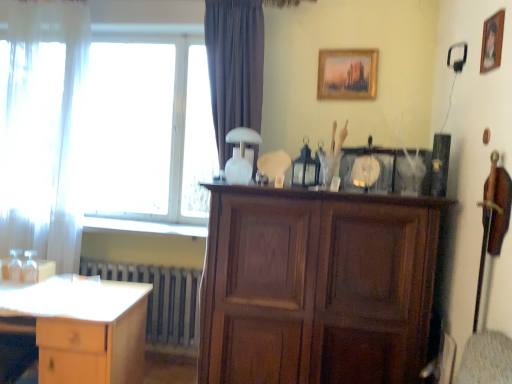
Where is `wooden cabinet at center`? wooden cabinet at center is located at coordinates (316, 287).

Locate an element on the screen. The image size is (512, 384). transparent glass window at upper left is located at coordinates (128, 128).

At what (x,y) coordinates should I click in order to perform the action: click on wooden picture frame at upper right, the first picture frame from the right. Please return your answer as a coordinate pair (x, y). Image resolution: width=512 pixels, height=384 pixels. Looking at the image, I should click on (492, 42).

Considering the relative sizes of light wood desk at lower left and transparent glass window at upper left in the image provided, is light wood desk at lower left smaller than transparent glass window at upper left?

Incorrect, light wood desk at lower left is not smaller in size than transparent glass window at upper left.

Are light wood desk at lower left and transparent glass window at upper left making contact?

light wood desk at lower left and transparent glass window at upper left are not in contact.

Considering the positions of objects light wood desk at lower left and transparent glass window at upper left in the image provided, who is behind, light wood desk at lower left or transparent glass window at upper left?

transparent glass window at upper left.

Considering the relative sizes of light wood desk at lower left and transparent glass window at upper left in the image provided, is light wood desk at lower left thinner than transparent glass window at upper left?

In fact, light wood desk at lower left might be wider than transparent glass window at upper left.

Considering the relative positions of wooden cabinet at center and light wood desk at lower left in the image provided, is wooden cabinet at center in front of light wood desk at lower left?

Yes, wooden cabinet at center is in front of light wood desk at lower left.

Would you say wooden cabinet at center is to the left or to the right of light wood desk at lower left in the picture?

wooden cabinet at center is positioned on light wood desk at lower left's right side.

This screenshot has width=512, height=384. Find the location of `cabinetry that appears above the light wood desk at lower left (from a real-world perspective)`. cabinetry that appears above the light wood desk at lower left (from a real-world perspective) is located at coordinates (316, 287).

Can you confirm if wooden cabinet at center is shorter than light wood desk at lower left?

No.

Would you consider gold-framed painting at upper center, the 1th picture frame from the back, to be distant from transparent glass window at upper left?

gold-framed painting at upper center, the 1th picture frame from the back, is far away from transparent glass window at upper left.

Is point (352, 99) closer or farther from the camera than point (126, 55)?

Point (352, 99) appears to be closer to the viewer than point (126, 55).

From a real-world perspective, does gold-framed painting at upper center, which ranks as the 1th picture frame in left-to-right order, stand above transparent glass window at upper left?

Yes, from a real-world perspective, gold-framed painting at upper center, which ranks as the 1th picture frame in left-to-right order, is over transparent glass window at upper left

Is gold-framed painting at upper center, the 1th picture frame from the back, smaller than transparent glass window at upper left?

Yes.

Is transparent glass window at upper left positioned far away from wooden picture frame at upper right, the first picture frame from the right?

Absolutely, transparent glass window at upper left is distant from wooden picture frame at upper right, the first picture frame from the right.

How distant is transparent glass window at upper left from wooden picture frame at upper right, placed as the 2th picture frame when sorted from back to front?

A distance of 7.48 feet exists between transparent glass window at upper left and wooden picture frame at upper right, placed as the 2th picture frame when sorted from back to front.

From their relative heights in the image, would you say transparent glass window at upper left is taller or shorter than wooden picture frame at upper right, the second picture frame viewed from the left?

Considering their sizes, transparent glass window at upper left has more height than wooden picture frame at upper right, the second picture frame viewed from the left.

Considering the points (92, 171) and (487, 59), which point is behind, point (92, 171) or point (487, 59)?

The point (92, 171) is farther.

Is wooden cabinet at center next to wooden picture frame at upper right, placed as the 1th picture frame when sorted from front to back, and touching it?

No.

Which object is closer to the camera taking this photo, wooden cabinet at center or wooden picture frame at upper right, the first picture frame from the right?

wooden picture frame at upper right, the first picture frame from the right.

Looking at this image, in terms of width, does wooden cabinet at center look wider or thinner when compared to wooden picture frame at upper right, placed as the 1th picture frame when sorted from front to back?

Considering their sizes, wooden cabinet at center looks broader than wooden picture frame at upper right, placed as the 1th picture frame when sorted from front to back.

Consider the image. Does white sheer curtain at left appear on the left side of transparent glass window at upper left?

Yes, white sheer curtain at left is to the left of transparent glass window at upper left.

From the image's perspective, is white sheer curtain at left above transparent glass window at upper left?

Incorrect, from the image's perspective, white sheer curtain at left is lower than transparent glass window at upper left.

From a real-world perspective, is white sheer curtain at left above or below transparent glass window at upper left?

white sheer curtain at left is below transparent glass window at upper left.

From a real-world perspective, between wooden picture frame at upper right, the first picture frame from the right, and wooden cabinet at center, who is vertically lower?

wooden cabinet at center is physically lower.

Based on the photo, visually, is wooden picture frame at upper right, the first picture frame from the right, positioned to the left or to the right of wooden cabinet at center?

wooden picture frame at upper right, the first picture frame from the right, is positioned on wooden cabinet at center's right side.

Who is more distant, wooden picture frame at upper right, the first picture frame from the right, or wooden cabinet at center?

wooden cabinet at center is further from the camera.

How much distance is there between wooden picture frame at upper right, placed as the 2th picture frame when sorted from back to front, and wooden cabinet at center?

wooden picture frame at upper right, placed as the 2th picture frame when sorted from back to front, and wooden cabinet at center are 4.24 feet apart.

You are a GUI agent. You are given a task and a screenshot of the screen. Output one action in this format:
    pyautogui.click(x=<x>, y=<y>)
    Task: Click on the window located behind the light wood desk at lower left
    This screenshot has width=512, height=384.
    Given the screenshot: What is the action you would take?
    pyautogui.click(x=128, y=128)

Image resolution: width=512 pixels, height=384 pixels. Find the location of `desk on the left side of wooden cabinet at center`. desk on the left side of wooden cabinet at center is located at coordinates (83, 328).

Which object lies nearer to the anchor point white sheer curtain at left, wooden cabinet at center or wooden picture frame at upper right, placed as the 1th picture frame when sorted from front to back?

Among the two, wooden cabinet at center is located nearer to white sheer curtain at left.

From the image, which object appears to be farther from white sheer curtain at left, gold-framed painting at upper center, the 2th picture frame positioned from the right, or light wood desk at lower left?

gold-framed painting at upper center, the 2th picture frame positioned from the right, is positioned further to the anchor white sheer curtain at left.

From the image, which object appears to be farther from wooden cabinet at center, white sheer curtain at left or light wood desk at lower left?

Based on the image, white sheer curtain at left appears to be further to wooden cabinet at center.

Based on the photo, based on their spatial positions, is transparent glass window at upper left or gold-framed painting at upper center, which appears as the 2th picture frame when viewed from the front, further from wooden picture frame at upper right, the second picture frame viewed from the left?

Based on the image, transparent glass window at upper left appears to be further to wooden picture frame at upper right, the second picture frame viewed from the left.

Considering their positions, is wooden cabinet at center positioned further to wooden picture frame at upper right, the second picture frame viewed from the left, than transparent glass window at upper left?

transparent glass window at upper left is further to wooden picture frame at upper right, the second picture frame viewed from the left.

Estimate the real-world distances between objects in this image. Which object is further from wooden picture frame at upper right, placed as the 1th picture frame when sorted from front to back, wooden cabinet at center or light wood desk at lower left?

light wood desk at lower left lies further to wooden picture frame at upper right, placed as the 1th picture frame when sorted from front to back, than the other object.

Looking at the image, which one is located closer to metallic gray radiator at lower left, gold-framed painting at upper center, the 2th picture frame positioned from the right, or light wood desk at lower left?

The object closer to metallic gray radiator at lower left is light wood desk at lower left.

When comparing their distances from wooden cabinet at center, does gold-framed painting at upper center, the 1th picture frame from the back, or white sheer curtain at left seem further?

white sheer curtain at left.

You are a GUI agent. You are given a task and a screenshot of the screen. Output one action in this format:
    pyautogui.click(x=<x>, y=<y>)
    Task: Click on the desk between white sheer curtain at left and wooden picture frame at upper right, the second picture frame viewed from the left
    
    Given the screenshot: What is the action you would take?
    pyautogui.click(x=83, y=328)

This screenshot has height=384, width=512. I want to click on cabinetry between white sheer curtain at left and gold-framed painting at upper center, which appears as the 2th picture frame when viewed from the front, from left to right, so click(316, 287).

Where is `cabinetry between gold-framed painting at upper center, the 1th picture frame from the back, and metallic gray radiator at lower left vertically`? cabinetry between gold-framed painting at upper center, the 1th picture frame from the back, and metallic gray radiator at lower left vertically is located at coordinates (316, 287).

You are a GUI agent. You are given a task and a screenshot of the screen. Output one action in this format:
    pyautogui.click(x=<x>, y=<y>)
    Task: Click on the cabinetry situated between light wood desk at lower left and gold-framed painting at upper center, which appears as the 2th picture frame when viewed from the front, from left to right
    The height and width of the screenshot is (384, 512).
    Given the screenshot: What is the action you would take?
    pyautogui.click(x=316, y=287)